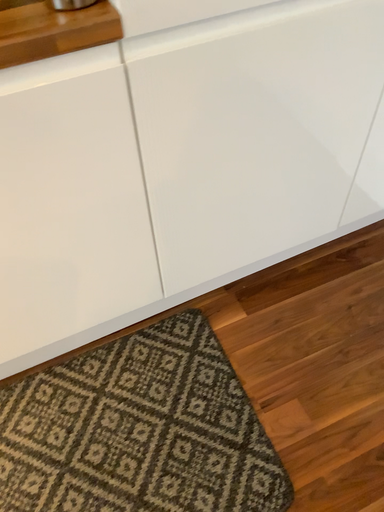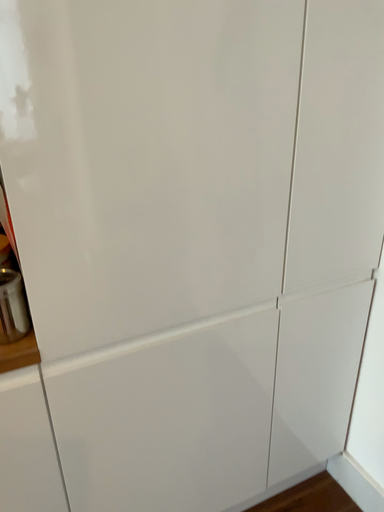
Question: Which way did the camera rotate in the video?

Choices:
 (A) rotated downward
 (B) rotated upward

Answer: (B)